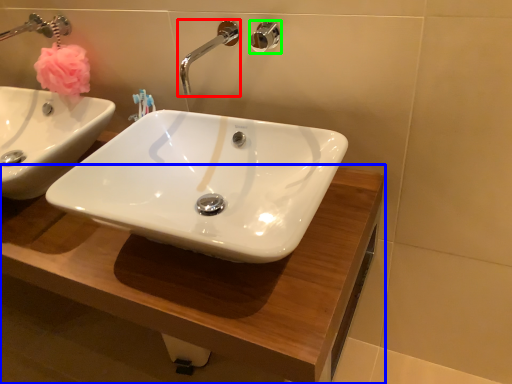
Question: Which object is positioned closest to tap (highlighted by a red box)? Select from counter top (highlighted by a blue box) and shower (highlighted by a green box).

Choices:
 (A) counter top
 (B) shower

Answer: (B)